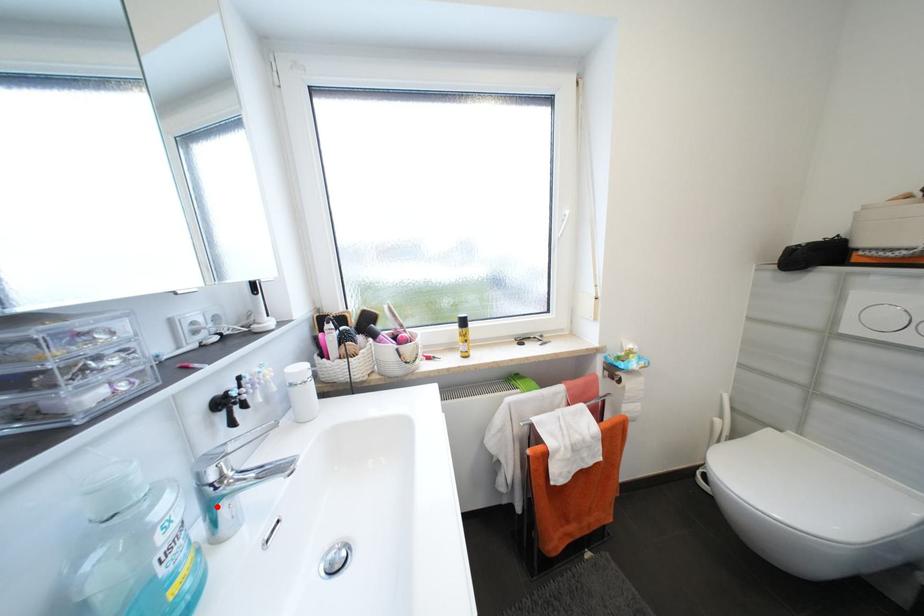
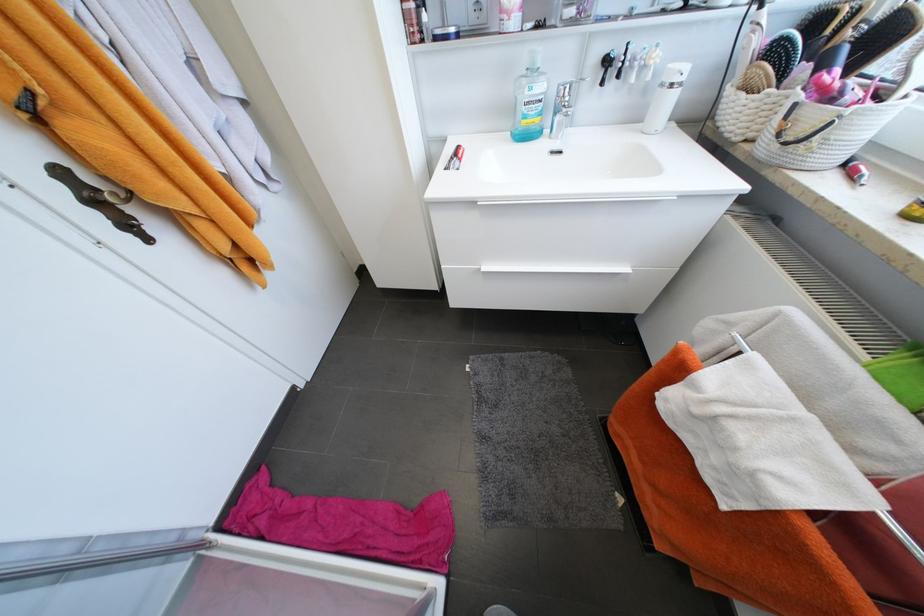
In the second image, find the point that corresponds to the highlighted location in the first image.

(562, 113)